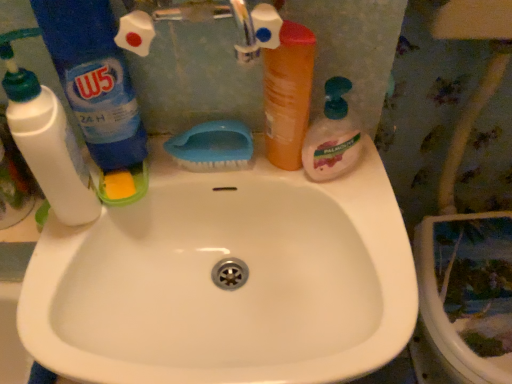
The width and height of the screenshot is (512, 384). In order to click on free space in front of translucent plastic soap dispenser at right, which ranks as the third cleaning product in left-to-right order in this screenshot , I will do `click(361, 237)`.